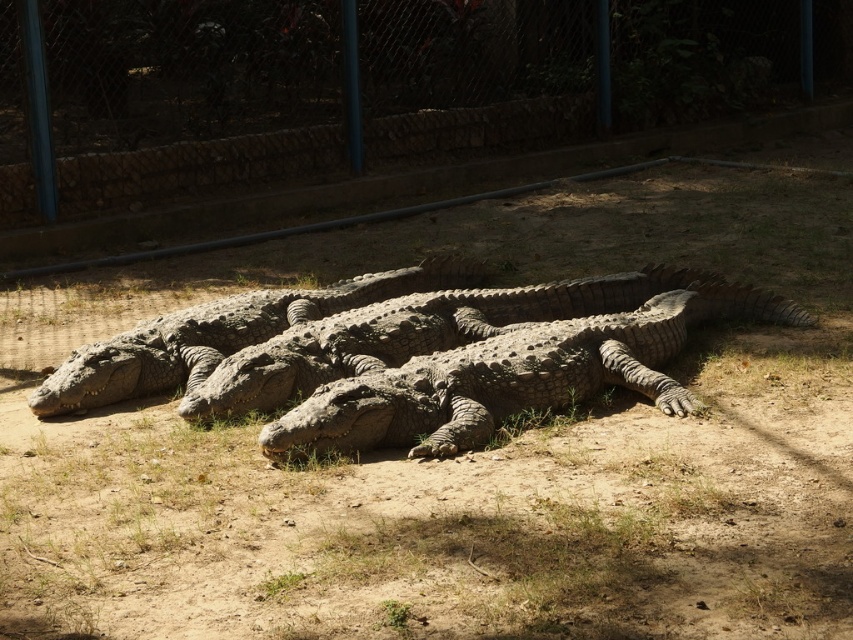
Is metal fence at upper center below gray textured crocodile at center?

Incorrect, metal fence at upper center is not positioned below gray textured crocodile at center.

Does metal fence at upper center have a lesser width compared to gray textured crocodile at center?

Yes.

Between point (96, 156) and point (78, 353), which one is positioned in front?

Positioned in front is point (78, 353).

Identify the location of metal fence at upper center. The image size is (853, 640). pos(189,96).

Is metal fence at upper center below rough textured crocodile at center?

No, metal fence at upper center is not below rough textured crocodile at center.

Which is behind, point (392, 160) or point (701, 296)?

Positioned behind is point (392, 160).

This screenshot has width=853, height=640. I want to click on metal fence at upper center, so click(189, 96).

This screenshot has height=640, width=853. What do you see at coordinates (515, 376) in the screenshot? I see `rough textured crocodile at center` at bounding box center [515, 376].

Does rough textured crocodile at center appear on the left side of gray textured crocodile at center?

No, rough textured crocodile at center is not to the left of gray textured crocodile at center.

This screenshot has width=853, height=640. I want to click on rough textured crocodile at center, so click(515, 376).

You are a GUI agent. You are given a task and a screenshot of the screen. Output one action in this format:
    pyautogui.click(x=<x>, y=<y>)
    Task: Click on the rough textured crocodile at center
    
    Given the screenshot: What is the action you would take?
    pyautogui.click(x=515, y=376)